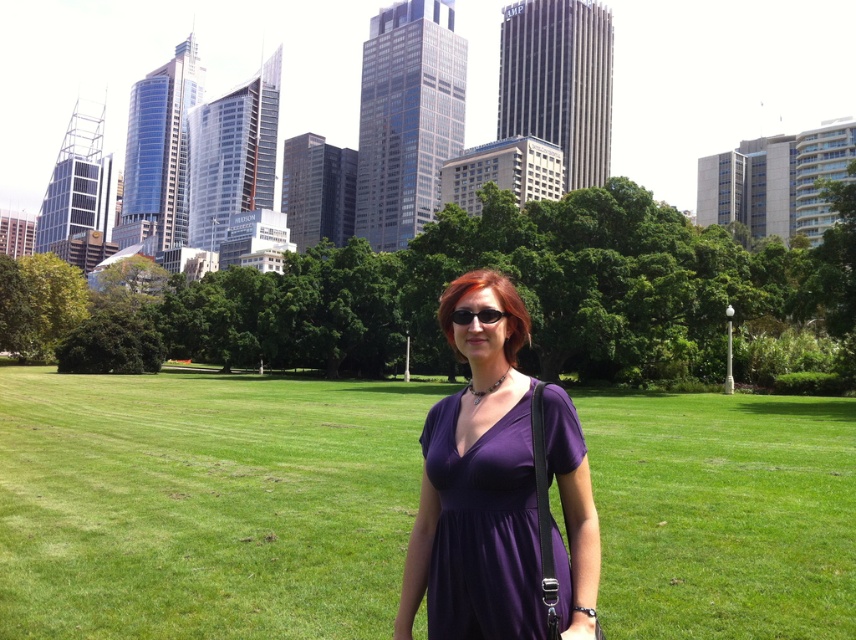
You are a photographer trying to capture the purple fabric dress at center and the purple matte dress at center in the same frame. Which dress should you adjust your camera to focus on first if you want to ensure both are in the shot?

The purple fabric dress at center is positioned on the left side of purple matte dress at center, so you should focus on the purple matte dress at center first to ensure both dresses are captured in the frame.

From the picture: You are standing at the point with coordinates point (461, 529) and want to walk towards the point with coordinates point (637, 397). Will you be moving forward or backward relative to your current position?

Moving from point (461, 529) to point (637, 397) requires moving forward since point (637, 397) is behind point (461, 529) relative to your current position.

You are a photographer trying to capture a closeup of the purple fabric dress at center and the black plastic sunglasses at center. Which object should you focus on first if you want to ensure both are in focus?

The purple fabric dress at center is positioned under the black plastic sunglasses at center, so you should focus on the purple fabric dress at center first to ensure both are in focus.